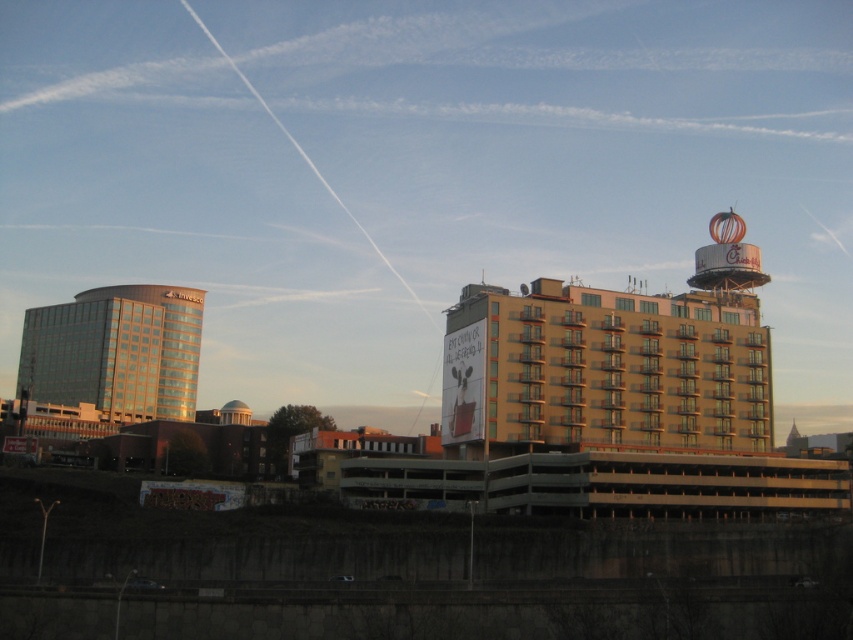
Measure the distance between yellow concrete building at center and shiny glass building at left.

95.62 meters

In the scene shown: Does yellow concrete building at center appear under shiny glass building at left?

Incorrect, yellow concrete building at center is not positioned below shiny glass building at left.

At what (x,y) coordinates should I click in order to perform the action: click on yellow concrete building at center. Please return your answer as a coordinate pair (x, y). The image size is (853, 640). Looking at the image, I should click on (606, 369).